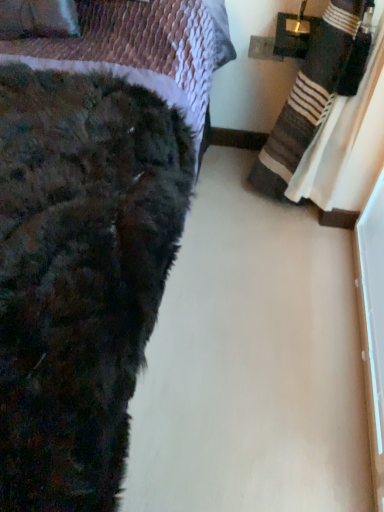
What are the coordinates of `free point in front of striped cotton blanket at right` in the screenshot? It's located at (279, 288).